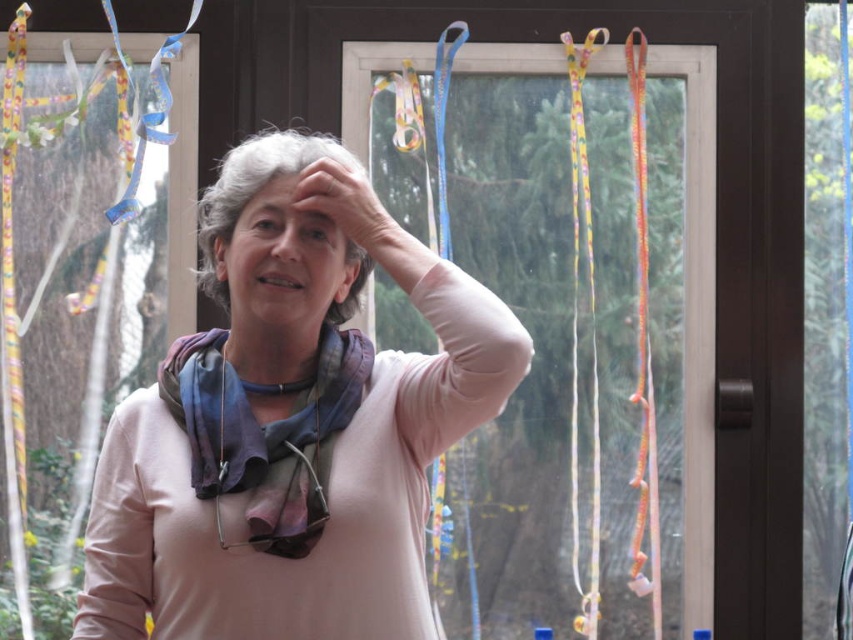
You are a photographer trying to capture the best angle of the two scarves. Since you want both scarves in the frame, which direction should you move your camera to ensure the multicolored silk scarf at center is on the left side of the pink fabric scarf at center?

The pink fabric scarf at center is already to the right of the multicolored silk scarf at center, so moving the camera to the left would keep both scarves in frame with the multicolored silk scarf at center on the left side of the pink fabric scarf at center.

You are a window cleaner who needs to reach both the transparent plastic ribbons at upper center and the multicolored silk scarf at center. Your extendable pole can reach up to 3 feet. Can you clean both items without moving your position?

The transparent plastic ribbons at upper center is 3.46 feet from the multicolored silk scarf at center. Since your pole can only reach up to 3 feet, you cannot reach both items without moving your position because the distance between them exceeds the pole length.